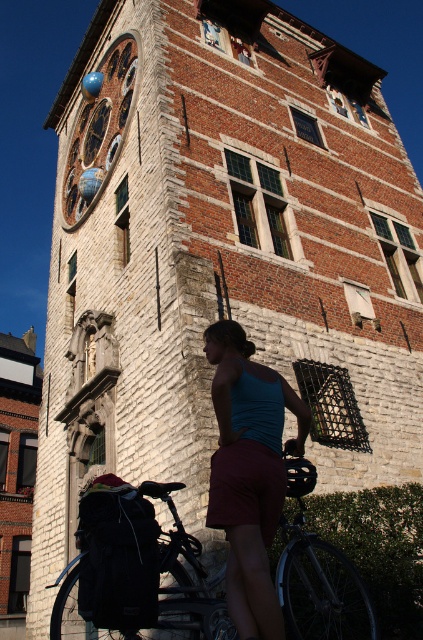
You are standing in front of the historic building and notice the teal fabric tank top at center and the blue glass clock at upper left. Which object is nearer to you?

The teal fabric tank top at center is closer to the viewer than the blue glass clock at upper left.

You are a delivery person trying to park your black matte bicycle at lower center near the blue glass clock at upper left. Based on the scene description, can you park the bicycle directly in front of the clock?

The black matte bicycle at lower center is to the right of blue glass clock at upper left, so it cannot be parked directly in front of the clock since it is positioned to the side rather than directly in front.